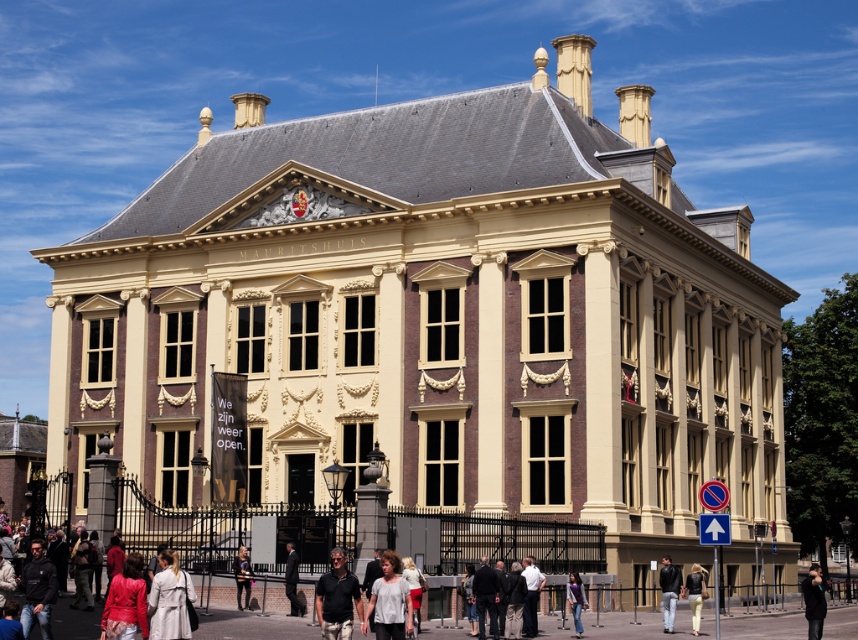
Can you confirm if white cotton shirt at lower center is positioned to the right of light brown leather jacket at lower center?

Correct, you'll find white cotton shirt at lower center to the right of light brown leather jacket at lower center.

Between white cotton shirt at lower center and light brown leather jacket at lower center, which one has more height?

With more height is white cotton shirt at lower center.

Does point (405, 616) come closer to viewer compared to point (246, 560)?

That is True.

This screenshot has height=640, width=858. Find the location of `white cotton shirt at lower center`. white cotton shirt at lower center is located at coordinates (390, 602).

Which is below, matte red jacket at lower left or leather jacket at lower right?

leather jacket at lower right is lower down.

Who is positioned more to the left, matte red jacket at lower left or leather jacket at lower right?

From the viewer's perspective, matte red jacket at lower left appears more on the left side.

Which is in front, point (124, 621) or point (678, 570)?

Point (124, 621)

Locate an element on the screen. The height and width of the screenshot is (640, 858). matte red jacket at lower left is located at coordinates (125, 602).

Is matte black shirt at center shorter than dark suit at center?

In fact, matte black shirt at center may be taller than dark suit at center.

Who is higher up, matte black shirt at center or dark suit at center?

matte black shirt at center is higher up.

Who is more forward, (346, 634) or (287, 582)?

Positioned in front is point (346, 634).

The width and height of the screenshot is (858, 640). Find the location of `matte black shirt at center`. matte black shirt at center is located at coordinates (337, 596).